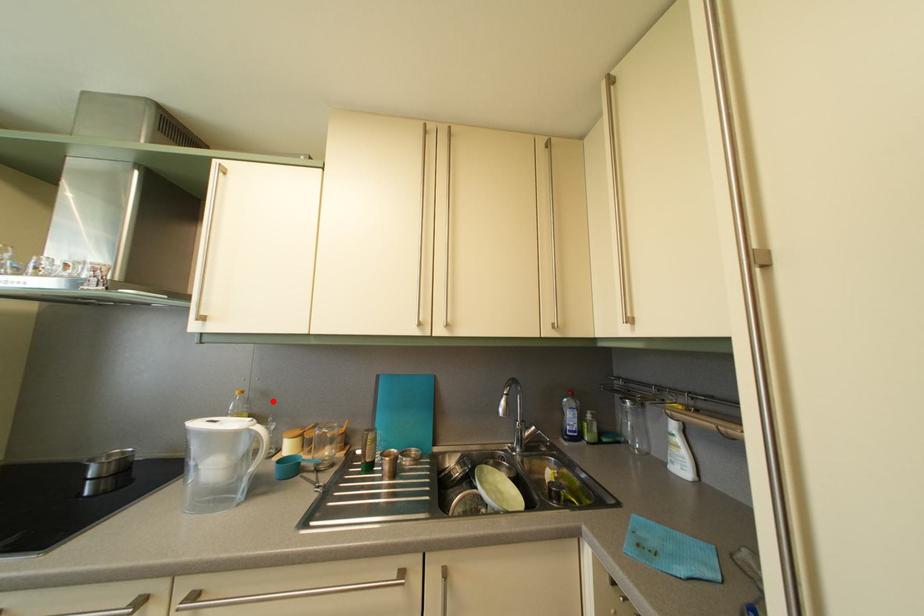
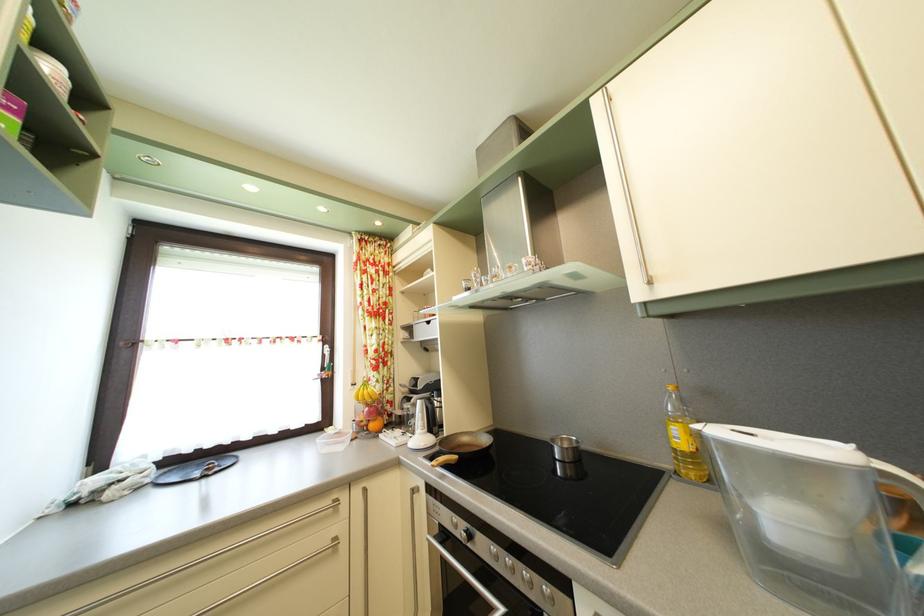
Find the pixel in the second image that matches the highlighted location in the first image.

(715, 400)